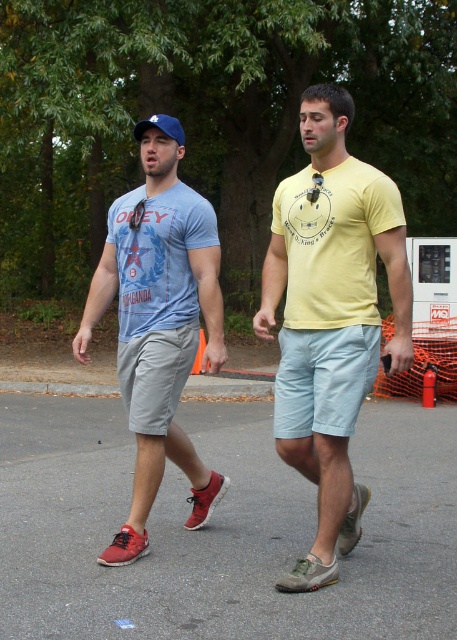
Can you confirm if yellow matte t-shirt at center is positioned below blue fabric baseball cap at left?

Actually, yellow matte t-shirt at center is above blue fabric baseball cap at left.

Is yellow matte t-shirt at center above blue fabric baseball cap at left?

Yes, yellow matte t-shirt at center is above blue fabric baseball cap at left.

Locate an element on the screen. The width and height of the screenshot is (457, 640). yellow matte t-shirt at center is located at coordinates (330, 316).

You are a GUI agent. You are given a task and a screenshot of the screen. Output one action in this format:
    pyautogui.click(x=<x>, y=<y>)
    Task: Click on the yellow matte t-shirt at center
    Image resolution: width=457 pixels, height=640 pixels.
    Given the screenshot: What is the action you would take?
    pyautogui.click(x=330, y=316)

Between blue fabric baseball cap at left and blue fabric baseball cap at upper center, which one is positioned higher?

blue fabric baseball cap at upper center is higher up.

Is blue fabric baseball cap at left to the left of blue fabric baseball cap at upper center from the viewer's perspective?

In fact, blue fabric baseball cap at left is to the right of blue fabric baseball cap at upper center.

Locate an element on the screen. This screenshot has width=457, height=640. blue fabric baseball cap at left is located at coordinates [159, 326].

Locate an element on the screen. blue fabric baseball cap at left is located at coordinates (159, 326).

Between point (318, 474) and point (138, 125), which one is positioned in front?

Positioned in front is point (318, 474).

Can you confirm if yellow matte t-shirt at center is positioned to the left of blue fabric baseball cap at upper center?

In fact, yellow matte t-shirt at center is to the right of blue fabric baseball cap at upper center.

Is point (317, 134) positioned in front of point (163, 129)?

Yes, it is in front of point (163, 129).

At what (x,y) coordinates should I click in order to perform the action: click on yellow matte t-shirt at center. Please return your answer as a coordinate pair (x, y). The height and width of the screenshot is (640, 457). Looking at the image, I should click on (330, 316).